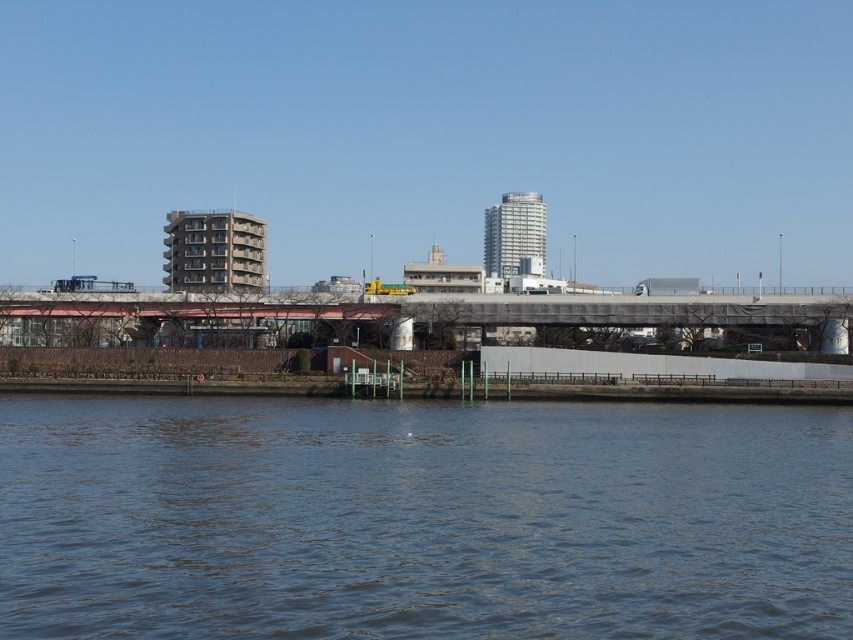
Does blue water at lower center appear on the left side of metallic gray bridge at center?

Incorrect, blue water at lower center is not on the left side of metallic gray bridge at center.

Who is lower down, blue water at lower center or metallic gray bridge at center?

blue water at lower center is lower down.

Is point (637, 627) positioned in front of point (480, 298)?

Yes, point (637, 627) is in front of point (480, 298).

At what (x,y) coordinates should I click in order to perform the action: click on blue water at lower center. Please return your answer as a coordinate pair (x, y). The height and width of the screenshot is (640, 853). Looking at the image, I should click on (422, 518).